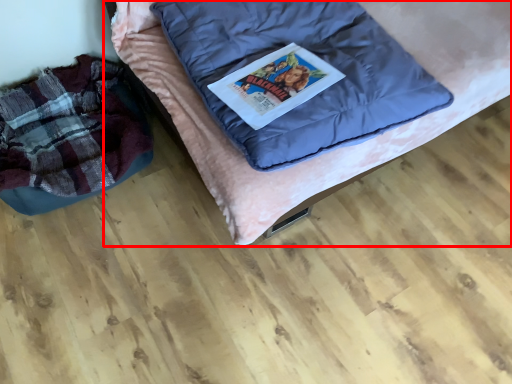
Question: From the image's perspective, where is furniture (annotated by the red box) located relative to bean bag chair?

Choices:
 (A) above
 (B) below

Answer: (A)